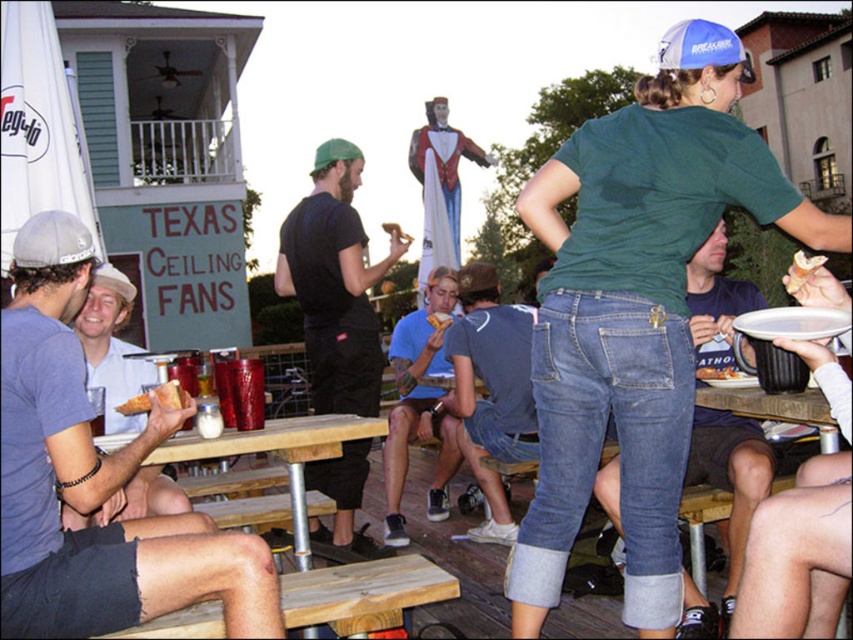
Locate an element on the screen. green matte shirt at upper right is located at coordinates (637, 310).

Who is more forward, (744, 173) or (178, 490)?

Point (744, 173) is more forward.

I want to click on green matte shirt at upper right, so click(637, 310).

Is matte black shirt at upper left to the right of golden bread at lower left from the viewer's perspective?

Indeed, matte black shirt at upper left is positioned on the right side of golden bread at lower left.

Is matte black shirt at upper left positioned at the back of golden bread at lower left?

No, it is not.

Which is in front, point (270, 609) or point (140, 401)?

Point (270, 609)

Locate an element on the screen. The height and width of the screenshot is (640, 853). matte black shirt at upper left is located at coordinates (96, 480).

Is the position of golden bread at lower left less distant than that of matte white plate at upper right?

No.

What do you see at coordinates (155, 397) in the screenshot? This screenshot has width=853, height=640. I see `golden bread at lower left` at bounding box center [155, 397].

Between point (184, 396) and point (808, 276), which one is positioned behind?

The point (808, 276) is behind.

Identify the location of golden bread at lower left. (155, 397).